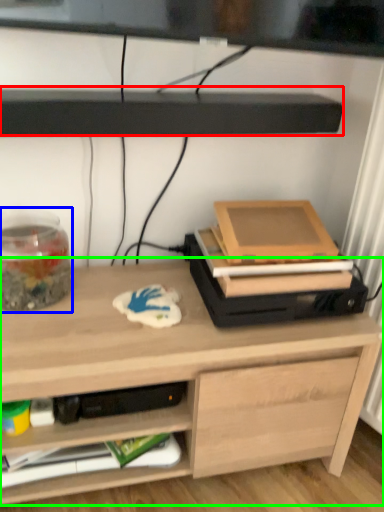
Question: Based on their relative distances, which object is farther from shelf (highlighted by a red box)? Choose from glass jar (highlighted by a blue box) and desk (highlighted by a green box).

Choices:
 (A) glass jar
 (B) desk

Answer: (B)